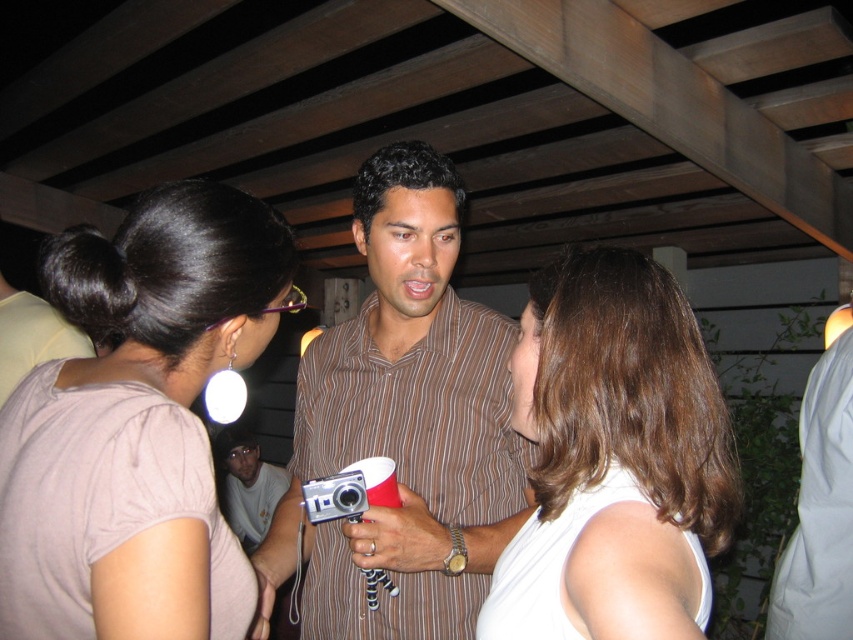
Question: Can you confirm if smooth white tank top at center is positioned to the left of gray cotton shirt at center?

Choices:
 (A) no
 (B) yes

Answer: (A)

Question: Which of these objects is positioned farthest from the gray cotton shirt at center?

Choices:
 (A) brown striped shirt at center
 (B) smooth white tank top at center
 (C) matte white earring at upper left

Answer: (B)

Question: Which object is the closest to the matte white earring at upper left?

Choices:
 (A) smooth white tank top at center
 (B) gray cotton shirt at center

Answer: (A)

Question: Among these objects, which one is farthest from the camera?

Choices:
 (A) brown striped shirt at center
 (B) smooth white tank top at center

Answer: (A)

Question: From the image, what is the correct spatial relationship of brown striped shirt at center in relation to gray cotton shirt at center?

Choices:
 (A) left
 (B) right

Answer: (B)

Question: Is brown striped shirt at center to the left of gray cotton shirt at center from the viewer's perspective?

Choices:
 (A) yes
 (B) no

Answer: (B)